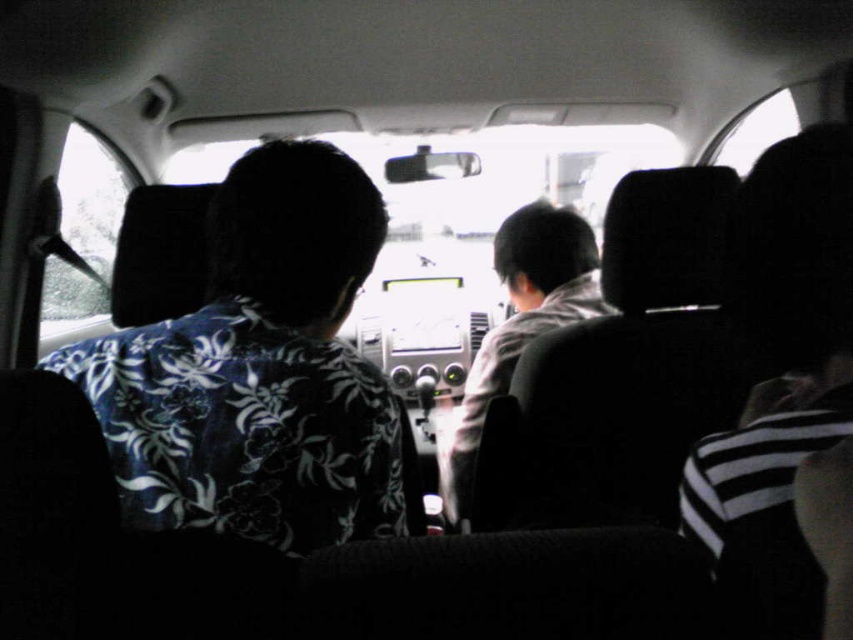
Who is positioned more to the left, floral-patterned shirt at left or gray hoodie at center?

floral-patterned shirt at left

What do you see at coordinates (259, 371) in the screenshot? The image size is (853, 640). I see `floral-patterned shirt at left` at bounding box center [259, 371].

This screenshot has height=640, width=853. In order to click on floral-patterned shirt at left in this screenshot , I will do `click(259, 371)`.